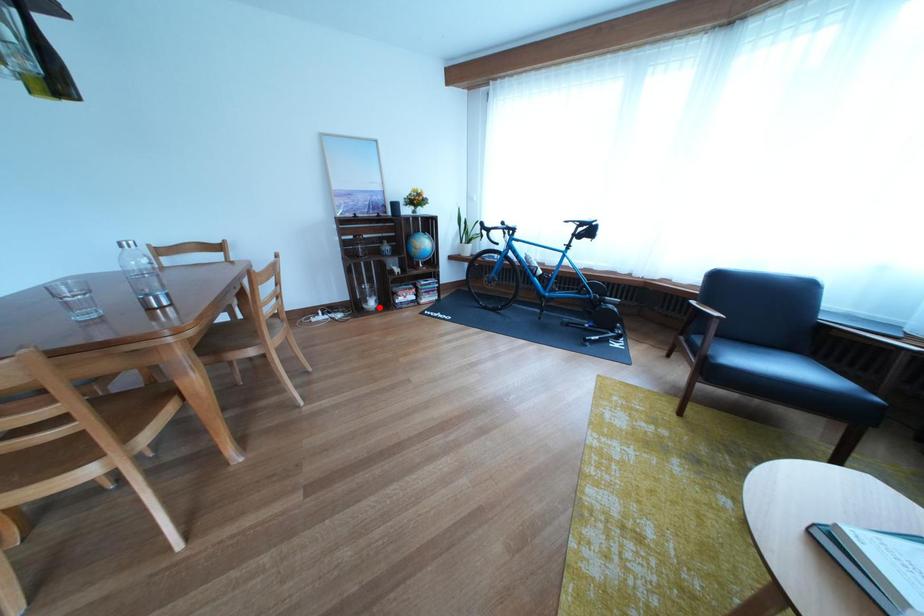
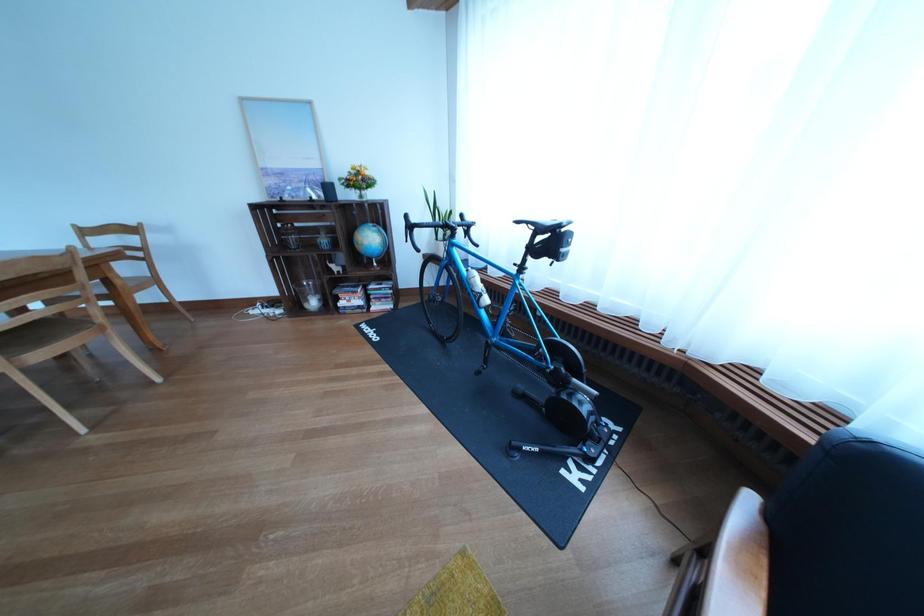
Where in the second image is the point corresponding to the highlighted location from the first image?

(321, 306)